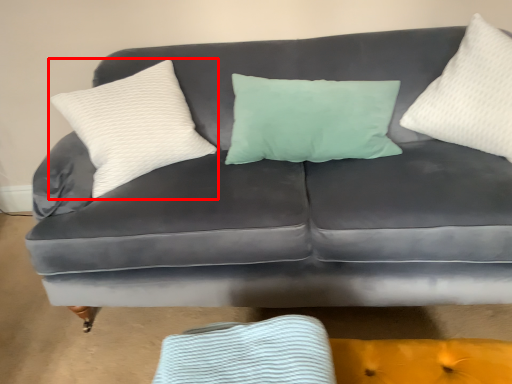
Question: Considering the relative positions of pillow (annotated by the red box) and pillow in the image provided, where is pillow (annotated by the red box) located with respect to the staircase?

Choices:
 (A) left
 (B) right

Answer: (A)